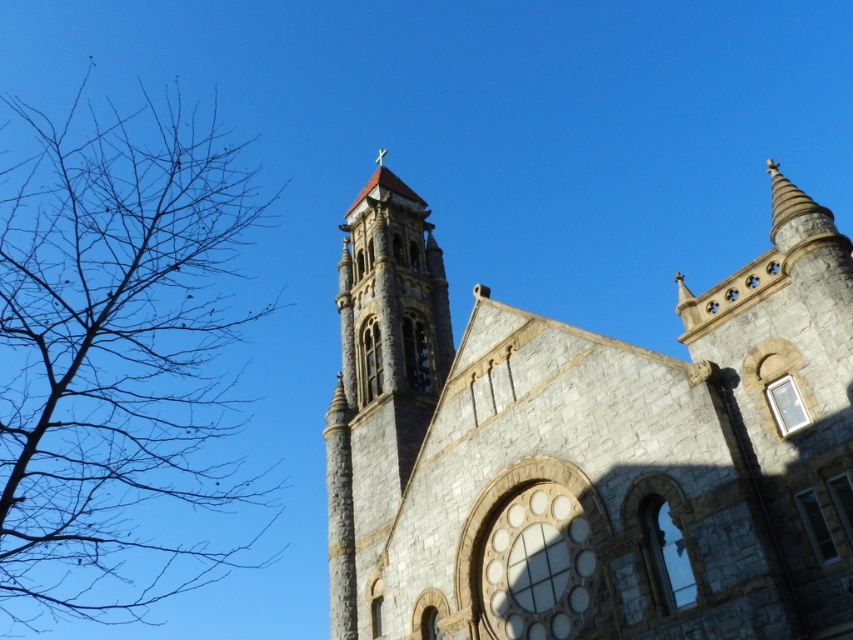
You are standing in front of the stone church at center and looking towards the brown bare branches at left. Are the branches above or below the church?

The stone church at center is below brown bare branches at left, so the branches are above the church.

You are an architect analyzing the stone church at center and the stone bell tower at center in the image. Which structure has a greater width according to the description?

The stone church at center has a greater width than the stone bell tower at center.

You are standing in front of the church and notice the brown bare branches at left and the stone bell tower at center. Which object appears larger in the image?

The brown bare branches at left appears larger than the stone bell tower at center in the image.